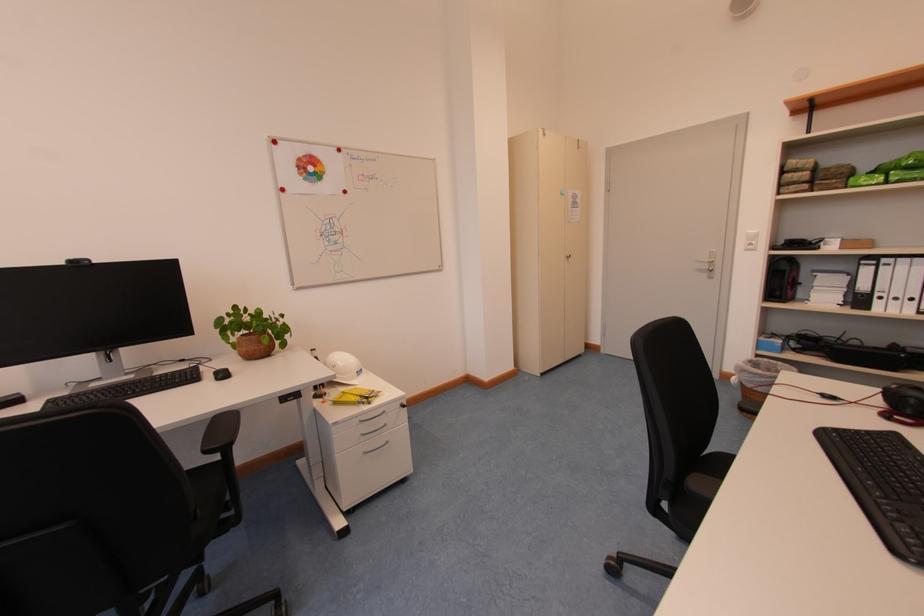
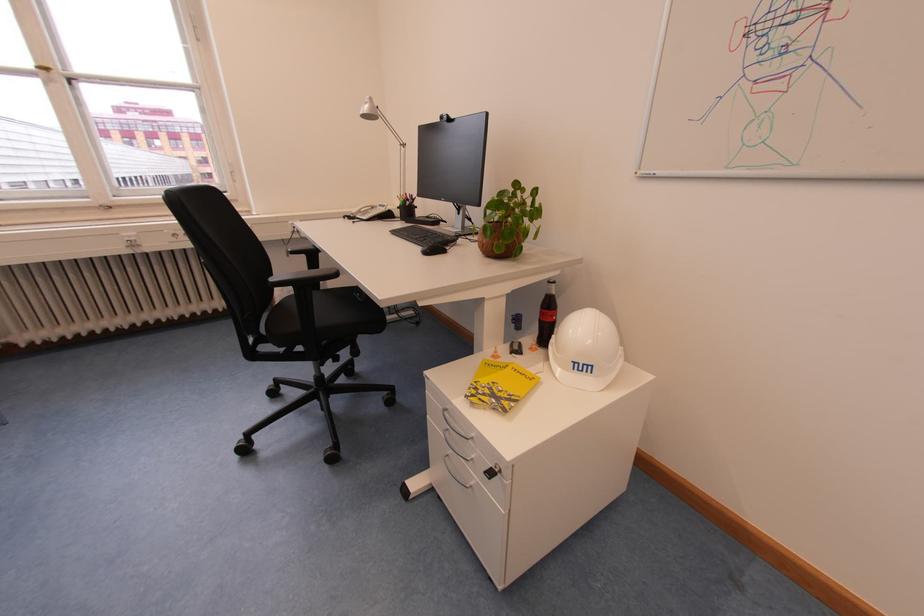
Find the pixel in the second image that matches the point at 377,395 in the first image.

(507, 397)